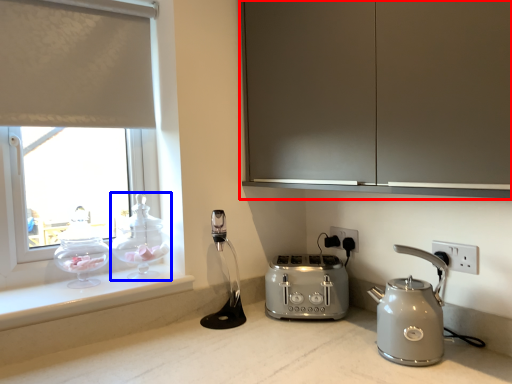
Question: Which of the following is the farthest to the observer, cabinetry (highlighted by a red box) or tea pot (highlighted by a blue box)?

Choices:
 (A) cabinetry
 (B) tea pot

Answer: (B)